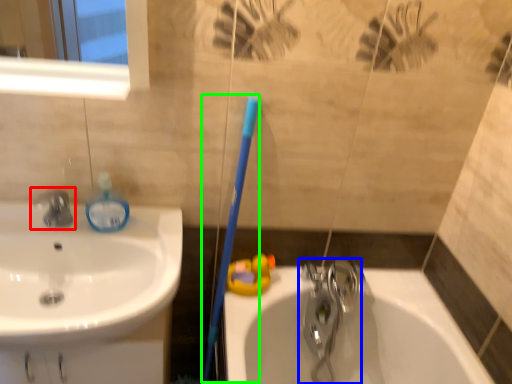
Question: Estimate the real-world distances between objects in this image. Which object is closer to tap (highlighted by a red box), tap (highlighted by a blue box) or toothbrush (highlighted by a green box)?

Choices:
 (A) tap
 (B) toothbrush

Answer: (B)